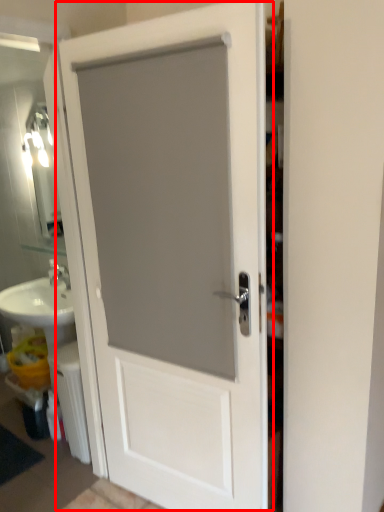
Question: Where is door (annotated by the red box) located in relation to radiator in the image?

Choices:
 (A) left
 (B) right

Answer: (B)